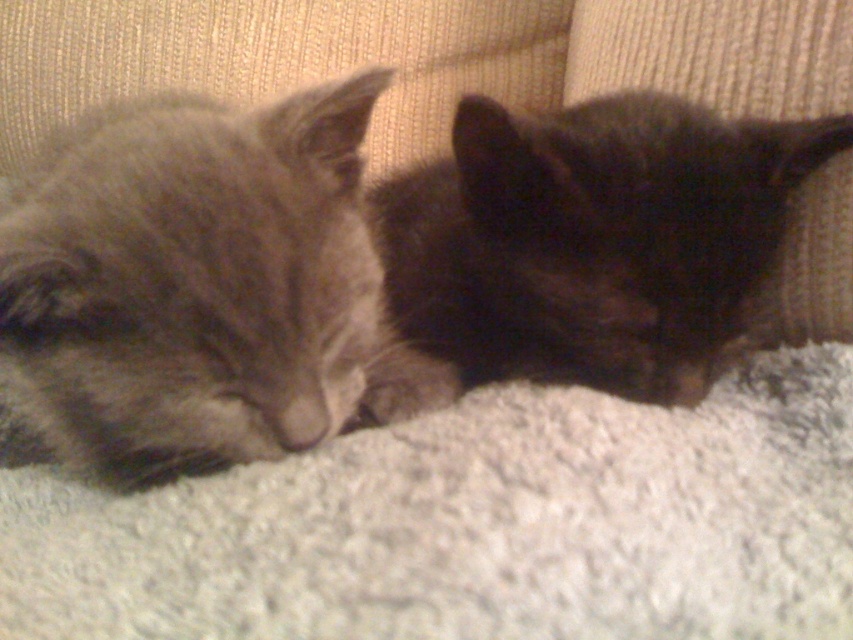
In the scene shown: You are a photographer trying to capture a closeup of both the gray fur cat at left and the black fur cat at center. Given their current positions, can you fit both cats into a single frame without moving them?

The gray fur cat at left occupies less space than the black fur cat at center, so it is possible to fit both into a single frame since the black fur cat at center takes up more space but they are positioned closely together.